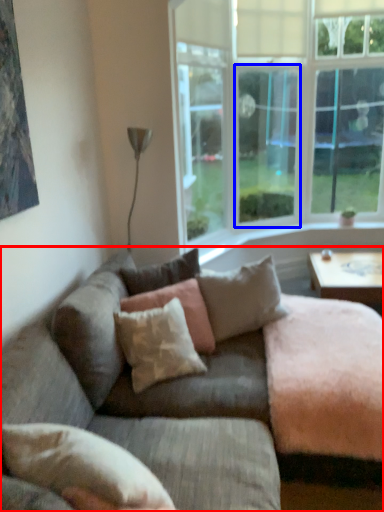
Question: Which object is further to the camera taking this photo, studio couch (highlighted by a red box) or window screen (highlighted by a blue box)?

Choices:
 (A) studio couch
 (B) window screen

Answer: (B)